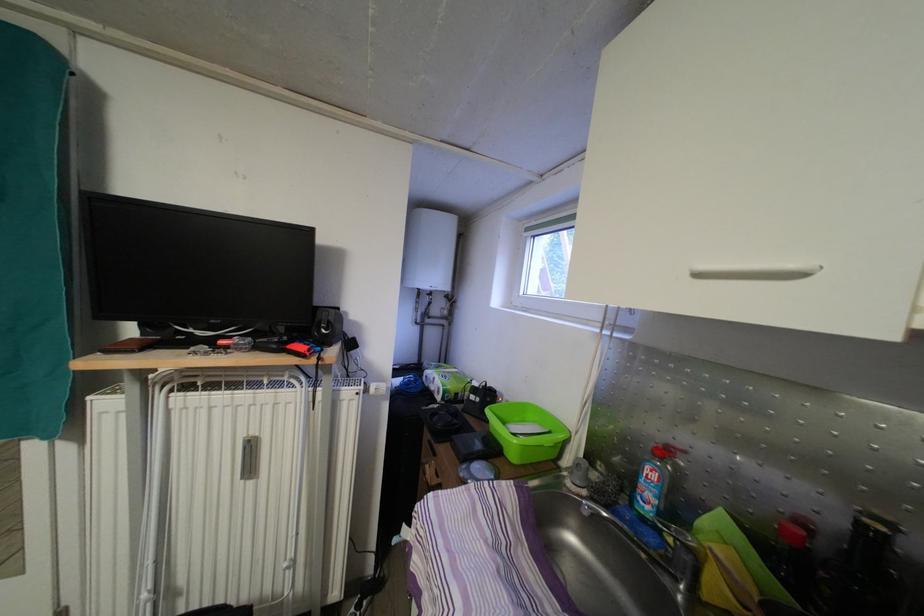
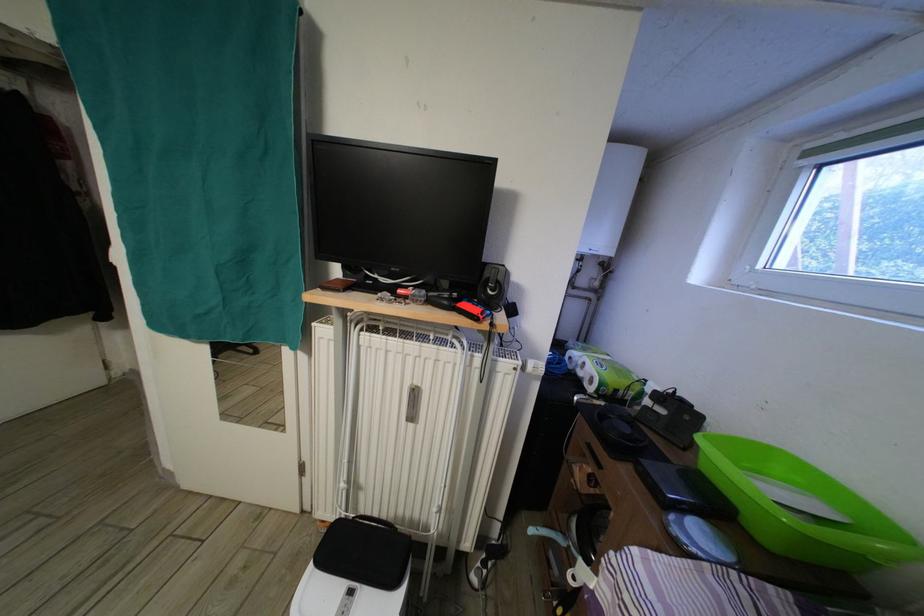
Question: The camera is either moving clockwise (left) or counter-clockwise (right) around the object. The first image is from the beginning of the video and the second image is from the end. Is the camera moving left or right when shooting the video?

Choices:
 (A) Left
 (B) Right

Answer: (B)